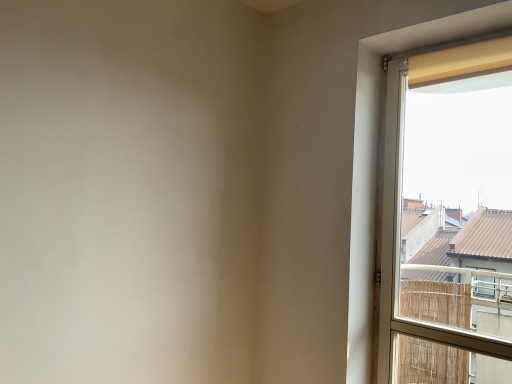
Identify the location of yellow fabric curtain at upper right. (460, 62).

What do you see at coordinates (460, 62) in the screenshot? I see `yellow fabric curtain at upper right` at bounding box center [460, 62].

Describe the element at coordinates (447, 218) in the screenshot. The image size is (512, 384). I see `matte yellow curtain at right` at that location.

Image resolution: width=512 pixels, height=384 pixels. Identify the location of matte yellow curtain at right. (447, 218).

Identify the location of yellow fabric curtain at upper right. The height and width of the screenshot is (384, 512). (460, 62).

Is matte yellow curtain at right to the right of yellow fabric curtain at upper right from the viewer's perspective?

No.

Which object is closer to the camera taking this photo, matte yellow curtain at right or yellow fabric curtain at upper right?

matte yellow curtain at right is in front.

Which point is more distant from viewer, (x=420, y=73) or (x=439, y=62)?

The point (x=420, y=73) is farther.

From the image's perspective, which object appears higher, matte yellow curtain at right or yellow fabric curtain at upper right?

yellow fabric curtain at upper right is shown above in the image.

From a real-world perspective, which object rests below the other?

matte yellow curtain at right.

Which of these two, matte yellow curtain at right or yellow fabric curtain at upper right, is thinner?

With smaller width is yellow fabric curtain at upper right.

Looking at this image, considering the sizes of objects matte yellow curtain at right and yellow fabric curtain at upper right in the image provided, who is shorter, matte yellow curtain at right or yellow fabric curtain at upper right?

yellow fabric curtain at upper right.

Who is smaller, matte yellow curtain at right or yellow fabric curtain at upper right?

With smaller size is yellow fabric curtain at upper right.

Do you think matte yellow curtain at right is within yellow fabric curtain at upper right, or outside of it?

matte yellow curtain at right lies outside yellow fabric curtain at upper right.

Is the surface of matte yellow curtain at right in direct contact with yellow fabric curtain at upper right?

matte yellow curtain at right is not next to yellow fabric curtain at upper right, and they're not touching.

Based on the photo, is matte yellow curtain at right oriented away from yellow fabric curtain at upper right?

Yes, matte yellow curtain at right is facing away from yellow fabric curtain at upper right.

In the scene shown: Measure the distance from matte yellow curtain at right to yellow fabric curtain at upper right.

73.62 centimeters.

Where is `curtain located above the matte yellow curtain at right (from a real-world perspective)`? The width and height of the screenshot is (512, 384). curtain located above the matte yellow curtain at right (from a real-world perspective) is located at coordinates (460, 62).

Which object is positioned more to the right, yellow fabric curtain at upper right or matte yellow curtain at right?

Positioned to the right is yellow fabric curtain at upper right.

Is yellow fabric curtain at upper right in front of or behind matte yellow curtain at right in the image?

yellow fabric curtain at upper right is positioned farther from the viewer than matte yellow curtain at right.

Is point (459, 65) closer to camera compared to point (500, 52)?

No, it is not.

From the image's perspective, is yellow fabric curtain at upper right beneath matte yellow curtain at right?

Actually, yellow fabric curtain at upper right appears above matte yellow curtain at right in the image.

From a real-world perspective, which object stands above the other?

From a 3D spatial view, yellow fabric curtain at upper right is above.

Which of these two, yellow fabric curtain at upper right or matte yellow curtain at right, is wider?

Wider between the two is matte yellow curtain at right.

Can you confirm if yellow fabric curtain at upper right is shorter than matte yellow curtain at right?

Yes, yellow fabric curtain at upper right is shorter than matte yellow curtain at right.

Is yellow fabric curtain at upper right bigger or smaller than matte yellow curtain at right?

Considering their sizes, yellow fabric curtain at upper right takes up less space than matte yellow curtain at right.

Is yellow fabric curtain at upper right spatially inside matte yellow curtain at right, or outside of it?

yellow fabric curtain at upper right fits inside matte yellow curtain at right.

Is yellow fabric curtain at upper right far from matte yellow curtain at right?

No, yellow fabric curtain at upper right is in close proximity to matte yellow curtain at right.

Is yellow fabric curtain at upper right turned away from matte yellow curtain at right?

Yes, yellow fabric curtain at upper right's orientation is away from matte yellow curtain at right.

At what (x,y) coordinates should I click in order to perform the action: click on curtain located on the right of matte yellow curtain at right. Please return your answer as a coordinate pair (x, y). The height and width of the screenshot is (384, 512). Looking at the image, I should click on (460, 62).

Find the location of a particular element. curtain above the matte yellow curtain at right (from the image's perspective) is located at coordinates (460, 62).

The width and height of the screenshot is (512, 384). Identify the location of window on the left side of yellow fabric curtain at upper right. (447, 218).